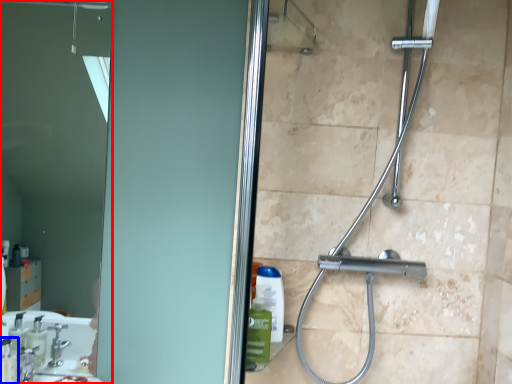
Question: Which point is further to the camera, mirror (highlighted by a red box) or soap dispenser (highlighted by a blue box)?

Choices:
 (A) mirror
 (B) soap dispenser

Answer: (A)